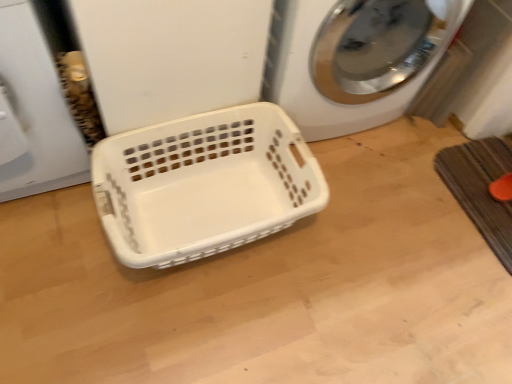
The image size is (512, 384). What are the coordinates of `free space in front of brown textured bath mat at lower right` in the screenshot? It's located at (464, 290).